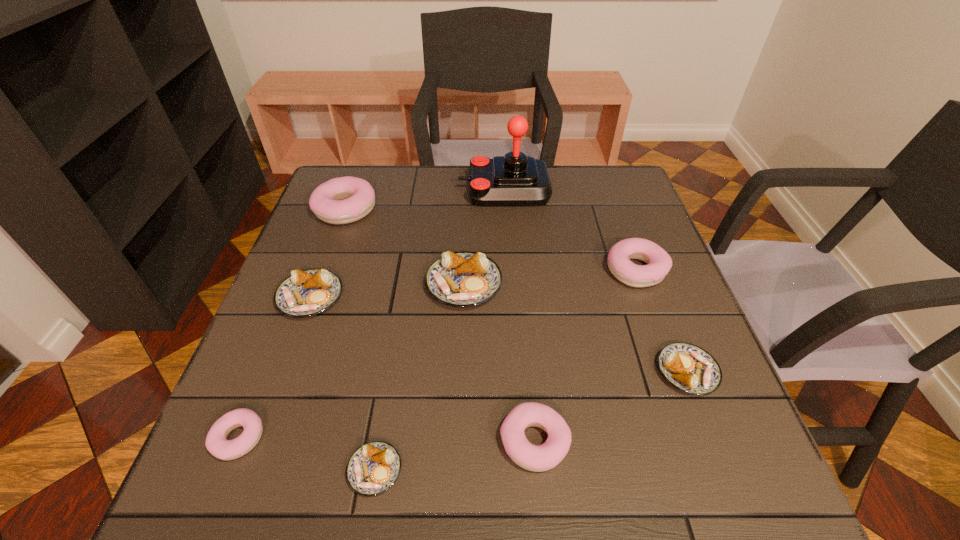
At what (x,y) coordinates should I click in order to perform the action: click on joystick. Please return your answer as a coordinate pair (x, y). This screenshot has height=540, width=960. Looking at the image, I should click on (515, 179).

This screenshot has width=960, height=540. I want to click on the farthest pink pastry, so click(342, 200).

The width and height of the screenshot is (960, 540). I want to click on the farthest pastry, so click(x=342, y=200).

The image size is (960, 540). Find the location of `the second brown pastry from right to left`. the second brown pastry from right to left is located at coordinates (462, 279).

Locate an element on the screen. Image resolution: width=960 pixels, height=540 pixels. the second biggest pink pastry is located at coordinates (659, 263).

Find the location of `the second farthest pink pastry`. the second farthest pink pastry is located at coordinates (659, 263).

Identify the location of the leftmost brown pastry. The image size is (960, 540). (306, 293).

Find the location of a particular element. Image resolution: width=960 pixels, height=540 pixels. the third biggest pink pastry is located at coordinates (546, 456).

This screenshot has width=960, height=540. I want to click on the sixth farthest object, so click(687, 367).

At what (x,y) coordinates should I click in order to perform the action: click on the rightmost brown pastry. Please return your answer as a coordinate pair (x, y). Looking at the image, I should click on (687, 367).